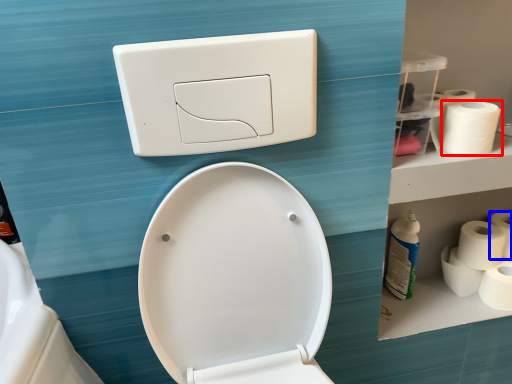
Question: Which object is closer to the camera taking this photo, toilet paper (highlighted by a red box) or toilet paper (highlighted by a blue box)?

Choices:
 (A) toilet paper
 (B) toilet paper

Answer: (A)